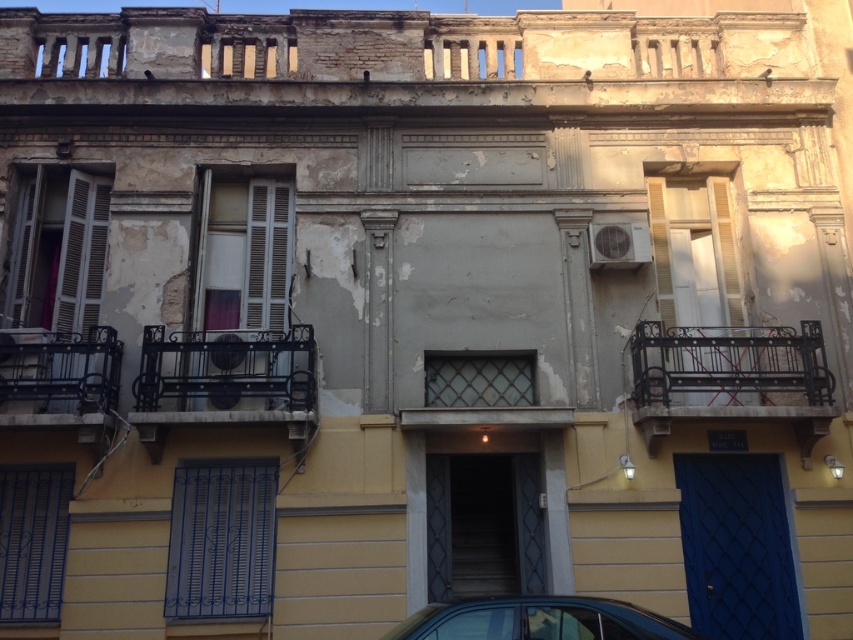
Is point (288, 280) closer to viewer compared to point (26, 408)?

No, it is behind (26, 408).

Can you confirm if white wooden shutters at center is shorter than black wrought iron balcony at left?

In fact, white wooden shutters at center may be taller than black wrought iron balcony at left.

Locate an element on the screen. white wooden shutters at center is located at coordinates (244, 282).

Consider the image. Is black wrought iron balcony at right closer to camera compared to white wooden shutters at center?

Yes, black wrought iron balcony at right is in front of white wooden shutters at center.

How much distance is there between black wrought iron balcony at right and white wooden shutters at center?

4.85 meters

Where is `black wrought iron balcony at right`? Image resolution: width=853 pixels, height=640 pixels. black wrought iron balcony at right is located at coordinates (730, 378).

Which is behind, point (718, 364) or point (13, 364)?

The point (718, 364) is more distant.

Is point (816, 346) positioned behind point (3, 358)?

Yes, it is.

Locate an element on the screen. The image size is (853, 640). black wrought iron balcony at right is located at coordinates coord(730,378).